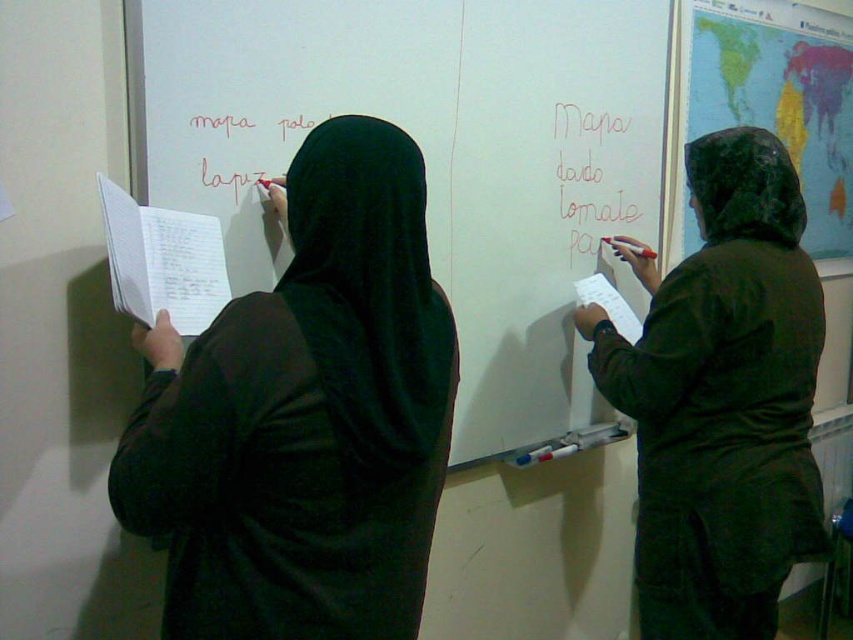
Question: Which object is farther from the camera taking this photo?

Choices:
 (A) white lined paper at left
 (B) white paper at center
 (C) dark green hooded jacket at right
 (D) matte red marker at right

Answer: (D)

Question: Does black matte hijab at upper left come behind matte red marker at upper left?

Choices:
 (A) yes
 (B) no

Answer: (B)

Question: Does matte red marker at right appear under matte red marker at upper left?

Choices:
 (A) yes
 (B) no

Answer: (B)

Question: Which of the following is the farthest from the observer?

Choices:
 (A) (537, 416)
 (B) (143, 339)
 (C) (199, 259)
 (D) (596, 292)

Answer: (A)

Question: Does matte red marker at upper left appear under white paper at center?

Choices:
 (A) no
 (B) yes

Answer: (A)

Question: Which object is positioned closest to the white matte whiteboard at upper center?

Choices:
 (A) dark green hooded jacket at right
 (B) matte red marker at upper left
 (C) white lined paper at left
 (D) matte red marker at right

Answer: (D)